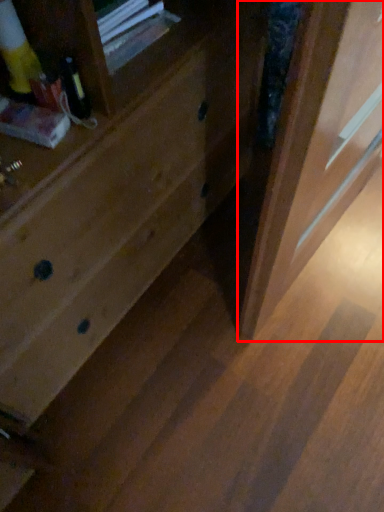
Question: From the image, what is the correct spatial relationship of screen door (annotated by the red box) in relation to drawer?

Choices:
 (A) right
 (B) left

Answer: (A)